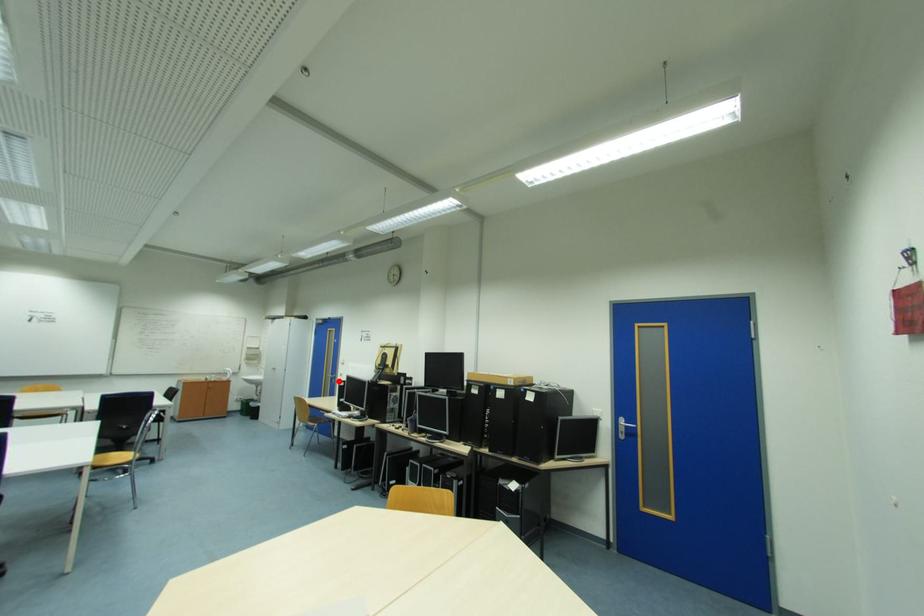
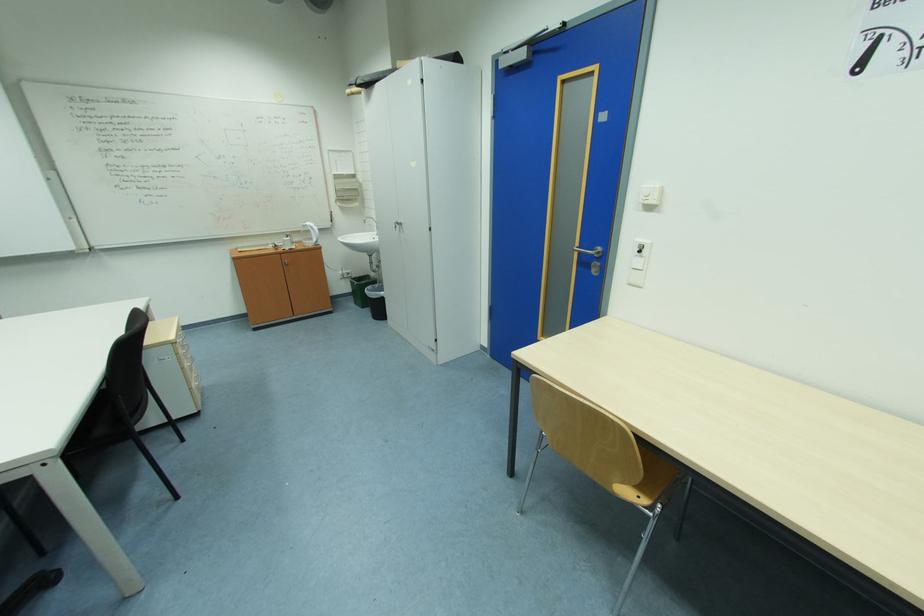
Find the pixel in the second image that matches the highlighted location in the first image.

(590, 264)